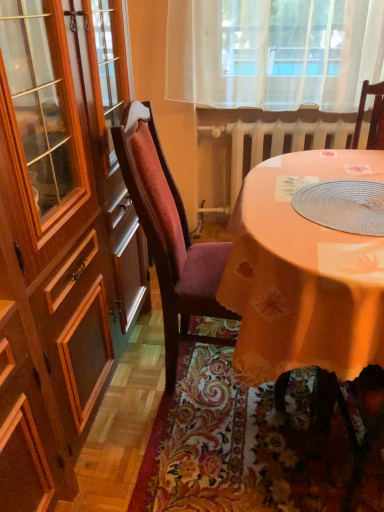
Question: Considering the relative positions of silky orange tablecloth at lower center and orange fabric table at center in the image provided, is silky orange tablecloth at lower center behind orange fabric table at center?

Choices:
 (A) no
 (B) yes

Answer: (B)

Question: Is there a large distance between silky orange tablecloth at lower center and orange fabric table at center?

Choices:
 (A) yes
 (B) no

Answer: (B)

Question: Is silky orange tablecloth at lower center positioned before orange fabric table at center?

Choices:
 (A) no
 (B) yes

Answer: (A)

Question: Can you confirm if silky orange tablecloth at lower center is bigger than orange fabric table at center?

Choices:
 (A) yes
 (B) no

Answer: (B)

Question: Considering the relative sizes of silky orange tablecloth at lower center and orange fabric table at center in the image provided, is silky orange tablecloth at lower center shorter than orange fabric table at center?

Choices:
 (A) yes
 (B) no

Answer: (A)

Question: Does silky orange tablecloth at lower center have a greater width compared to orange fabric table at center?

Choices:
 (A) yes
 (B) no

Answer: (A)

Question: Is clear plastic placemat at center in contact with orange fabric table at center?

Choices:
 (A) yes
 (B) no

Answer: (B)

Question: Is clear plastic placemat at center taller than orange fabric table at center?

Choices:
 (A) no
 (B) yes

Answer: (A)

Question: Is clear plastic placemat at center smaller than orange fabric table at center?

Choices:
 (A) yes
 (B) no

Answer: (A)

Question: Does clear plastic placemat at center come behind orange fabric table at center?

Choices:
 (A) no
 (B) yes

Answer: (B)

Question: Is clear plastic placemat at center turned away from orange fabric table at center?

Choices:
 (A) no
 (B) yes

Answer: (B)

Question: From the image's perspective, is clear plastic placemat at center beneath orange fabric table at center?

Choices:
 (A) yes
 (B) no

Answer: (B)

Question: From a real-world perspective, is orange fabric table at center on white painted metal radiator at center?

Choices:
 (A) no
 (B) yes

Answer: (B)